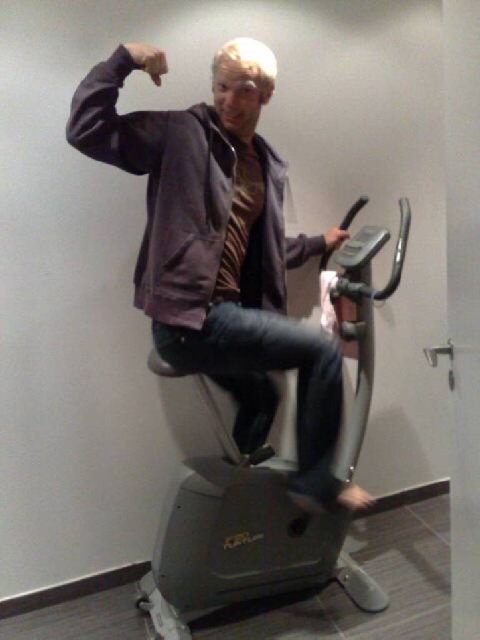
You are an interior designer planning to place a new coat rack in the room. You see the matte purple jacket at center and the metallic gray exercise bike at center. Which object is positioned higher in the scene?

The matte purple jacket at center is above the metallic gray exercise bike at center, so it is positioned higher in the scene.

You are standing in the room where the person is exercising on the stationary exercise bike. You notice two points marked on the wall. The first point is at coordinates point (117, 141), and the second is at point (248, 468). From your perspective, which point is closer to you?

Point (117, 141) is in front of point (248, 468), so it is closer to you.